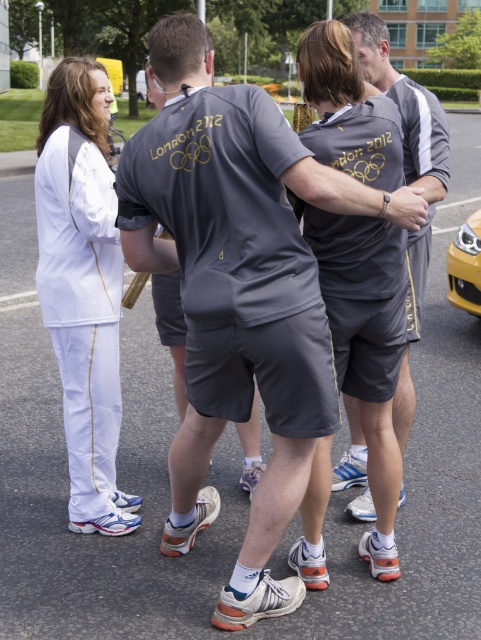
Question: Among these objects, which one is farthest from the camera?

Choices:
 (A) yellow matte car at right
 (B) white smooth uniform at left
 (C) gray athletic shorts at center
 (D) matte gray t-shirt at center

Answer: (A)

Question: Does white smooth uniform at left lie behind gray athletic shorts at center?

Choices:
 (A) no
 (B) yes

Answer: (A)

Question: Which object is closer to the camera taking this photo?

Choices:
 (A) white smooth uniform at left
 (B) matte gray t-shirt at center
 (C) yellow matte car at right
 (D) gray athletic shorts at center

Answer: (B)

Question: Is matte gray t-shirt at center below yellow matte car at right?

Choices:
 (A) no
 (B) yes

Answer: (B)

Question: Estimate the real-world distances between objects in this image. Which object is closer to the gray athletic shorts at center?

Choices:
 (A) yellow matte car at right
 (B) matte gray t-shirt at center
 (C) white smooth uniform at left

Answer: (B)

Question: Does matte gray t-shirt at center appear on the left side of white smooth uniform at left?

Choices:
 (A) no
 (B) yes

Answer: (A)